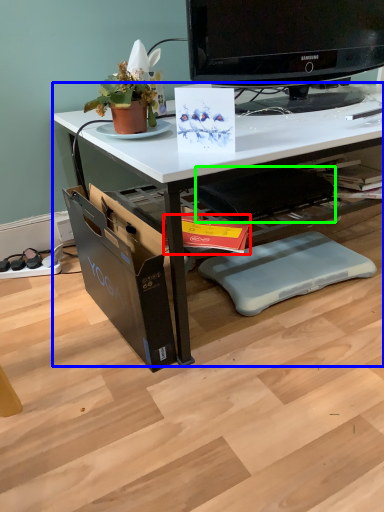
Question: Estimate the real-world distances between objects in this image. Which object is closer to magazine (highlighted by a red box), desk (highlighted by a blue box) or swivel chair (highlighted by a green box)?

Choices:
 (A) desk
 (B) swivel chair

Answer: (B)